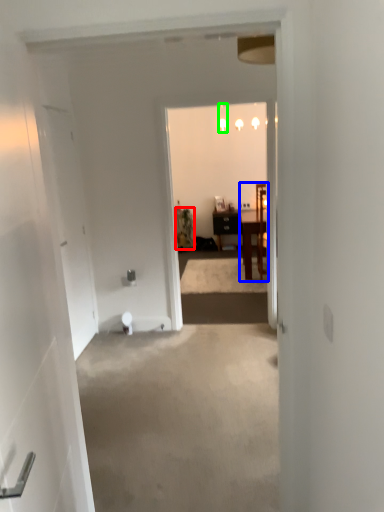
Question: Estimate the real-world distances between objects in this image. Which object is farther from houseplant (highlighted by a red box), chair (highlighted by a blue box) or lamp (highlighted by a green box)?

Choices:
 (A) chair
 (B) lamp

Answer: (B)